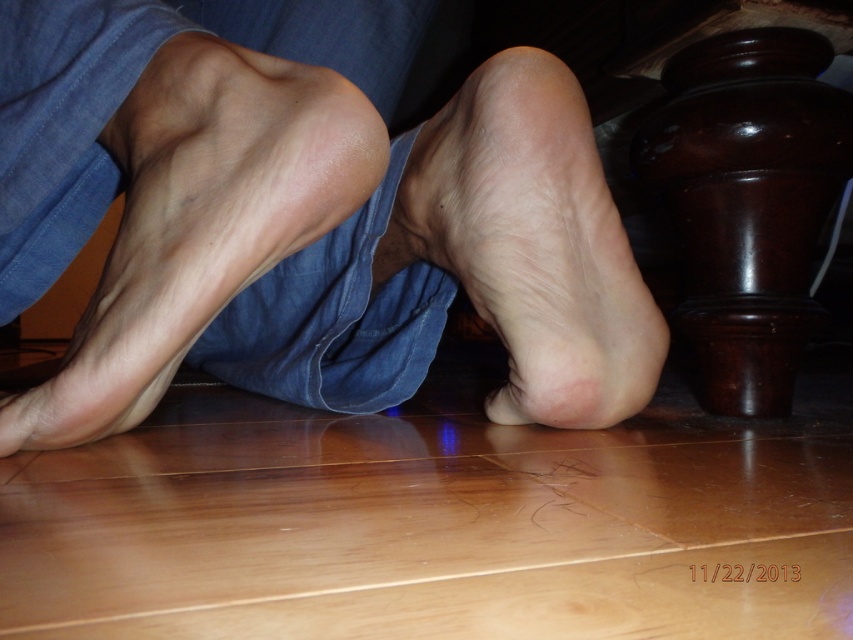
You are a photographer adjusting your camera to focus on the feet in the image. The focus point is set at coordinates point [305,212]. Based on the scene description, where is this focus point located?

The focus point at point [305,212] is on the smooth skin feet at center.

You are a photographer setting up a shoot in the scene described. You need to place a small prop between the smooth skin feet at center and the smooth skin foot at center. Given their sizes, which object should the prop be placed closer to?

The smooth skin feet at center is bigger than the smooth skin foot at center, so the prop should be placed closer to the smooth skin feet at center to ensure proper spacing between them.